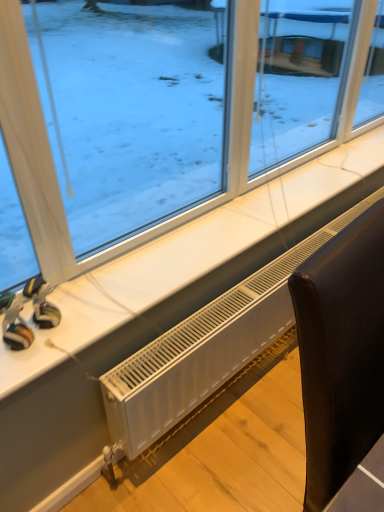
Question: Which is correct: black leather chair at lower right is inside transparent glass window at upper center, or outside of it?

Choices:
 (A) inside
 (B) outside

Answer: (B)

Question: Is black leather chair at lower right wider or thinner than transparent glass window at upper center?

Choices:
 (A) thin
 (B) wide

Answer: (B)

Question: Estimate the real-world distances between objects in this image. Which object is farther from the transparent glass window at upper center?

Choices:
 (A) matte plastic toy at lower left, acting as the 1th toy starting from the right
 (B) black leather chair at lower right
 (C) rubberized plastic toy at lower left, the second toy in the right-to-left sequence
 (D) white plastic radiator at lower center

Answer: (B)

Question: Based on their relative distances, which object is farther from the transparent glass window at upper center?

Choices:
 (A) rubberized plastic toy at lower left, the second toy in the right-to-left sequence
 (B) white plastic radiator at lower center
 (C) matte plastic toy at lower left, acting as the 1th toy starting from the right
 (D) black leather chair at lower right

Answer: (D)